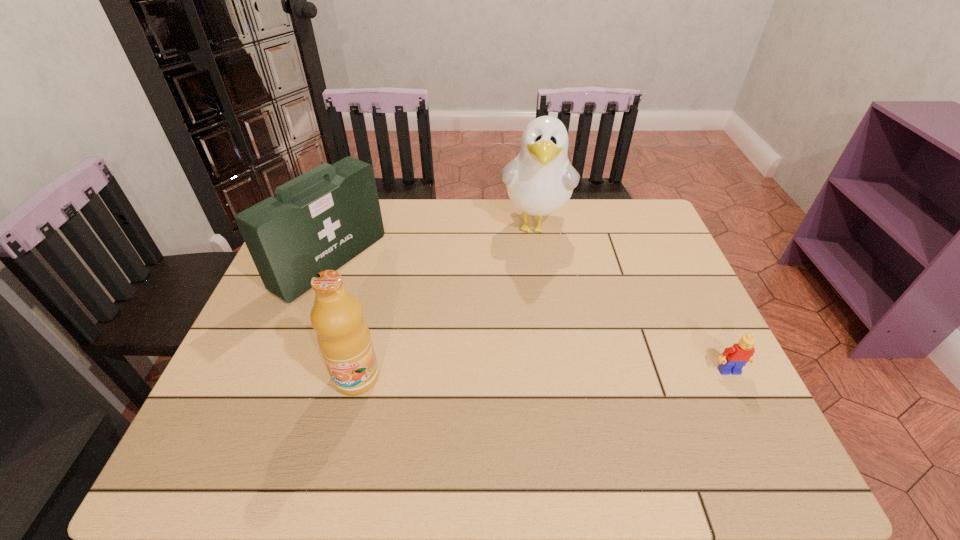
Where is `free space on the desktop that is between the fruit juice and the Lego and is positioned on the beak of the tallest object`? The image size is (960, 540). free space on the desktop that is between the fruit juice and the Lego and is positioned on the beak of the tallest object is located at coordinates (515, 375).

The image size is (960, 540). Find the location of `vacant spot on the desktop that is between the fruit juice and the shortest object and is positioned on the front-facing side of the first-aid kit`. vacant spot on the desktop that is between the fruit juice and the shortest object and is positioned on the front-facing side of the first-aid kit is located at coordinates (532, 374).